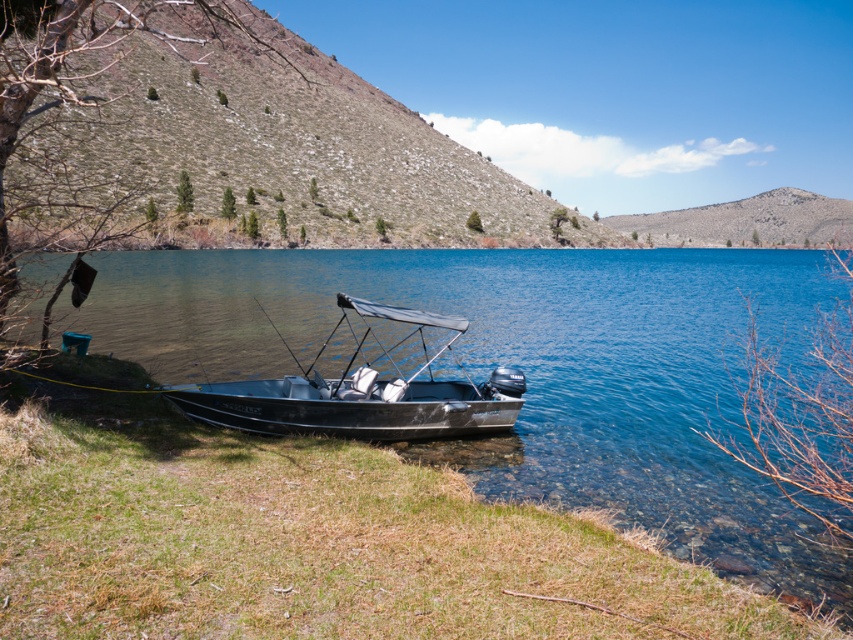
Question: Does green grassy hillside at upper left appear over metallic gray boat at lower center?

Choices:
 (A) no
 (B) yes

Answer: (B)

Question: Considering the real-world distances, which object is closest to the green grassy hillside at upper left?

Choices:
 (A) clear blue water at lower left
 (B) metallic gray boat at lower center
 (C) dull gray rock at upper center

Answer: (A)

Question: Which of the following is the farthest from the observer?

Choices:
 (A) green grassy hillside at upper left
 (B) dull gray rock at upper center

Answer: (B)

Question: Which is farther from the clear blue water at lower left?

Choices:
 (A) green grassy hillside at upper left
 (B) dull gray rock at upper center

Answer: (B)

Question: Can you confirm if green grassy hillside at upper left is positioned above metallic gray boat at lower center?

Choices:
 (A) yes
 (B) no

Answer: (A)

Question: Is clear blue water at lower left to the right of green grassy hillside at upper left from the viewer's perspective?

Choices:
 (A) yes
 (B) no

Answer: (A)